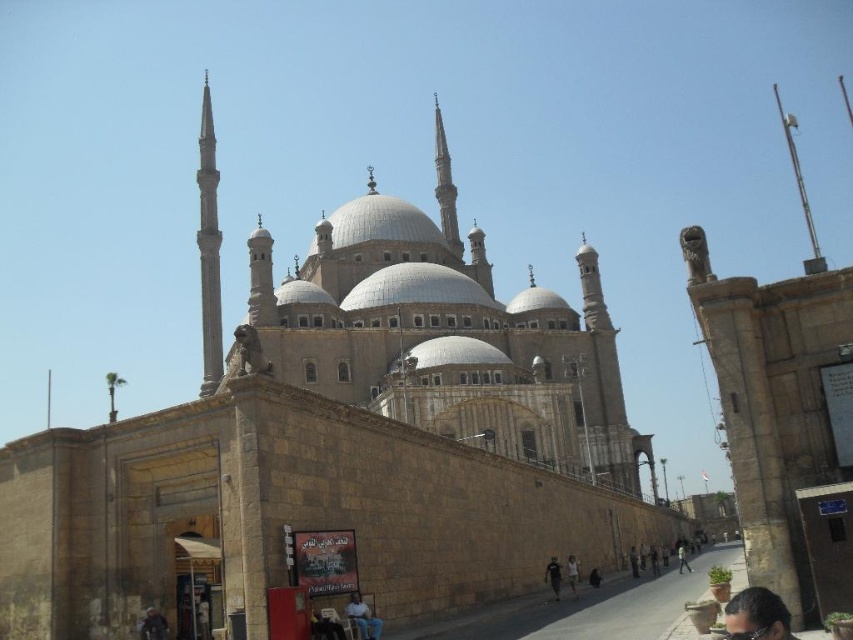
Can you confirm if blue jeans at lower center is positioned to the right of dark brown leather jacket at lower center?

In fact, blue jeans at lower center is to the left of dark brown leather jacket at lower center.

At what (x,y) coordinates should I click in order to perform the action: click on blue jeans at lower center. Please return your answer as a coordinate pair (x, y). Looking at the image, I should click on (363, 618).

Which is behind, point (772, 637) or point (572, 593)?

Positioned behind is point (572, 593).

Who is positioned more to the left, dark brown hair at lower right or white cotton shirt at lower center?

Positioned to the left is white cotton shirt at lower center.

Describe the element at coordinates (757, 616) in the screenshot. This screenshot has width=853, height=640. I see `dark brown hair at lower right` at that location.

What are the coordinates of `dark brown hair at lower right` in the screenshot? It's located at (757, 616).

Between point (374, 632) and point (560, 572), which one is positioned behind?

Positioned behind is point (560, 572).

Is blue jeans at lower center to the left of black fabric person at lower center from the viewer's perspective?

Indeed, blue jeans at lower center is positioned on the left side of black fabric person at lower center.

Locate an element on the screen. blue jeans at lower center is located at coordinates (363, 618).